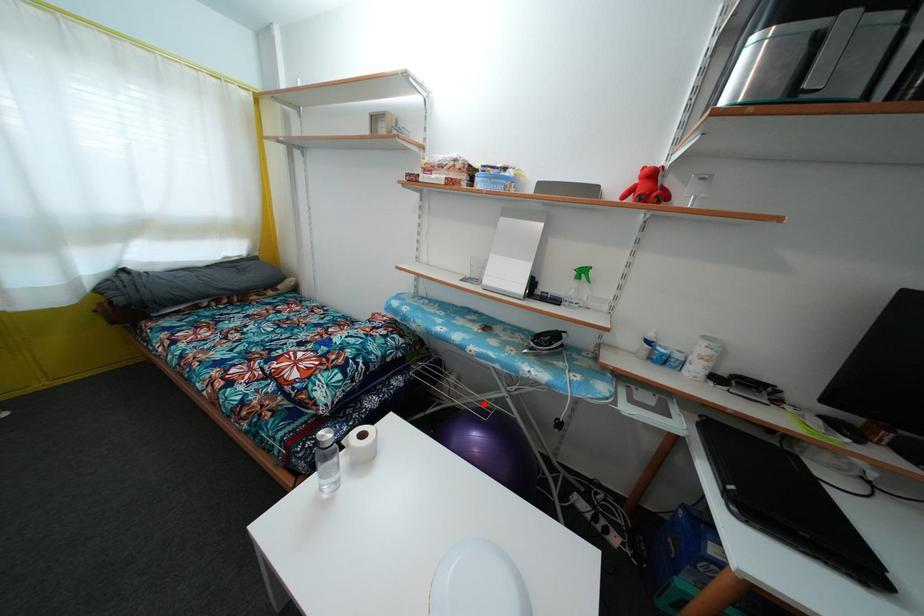
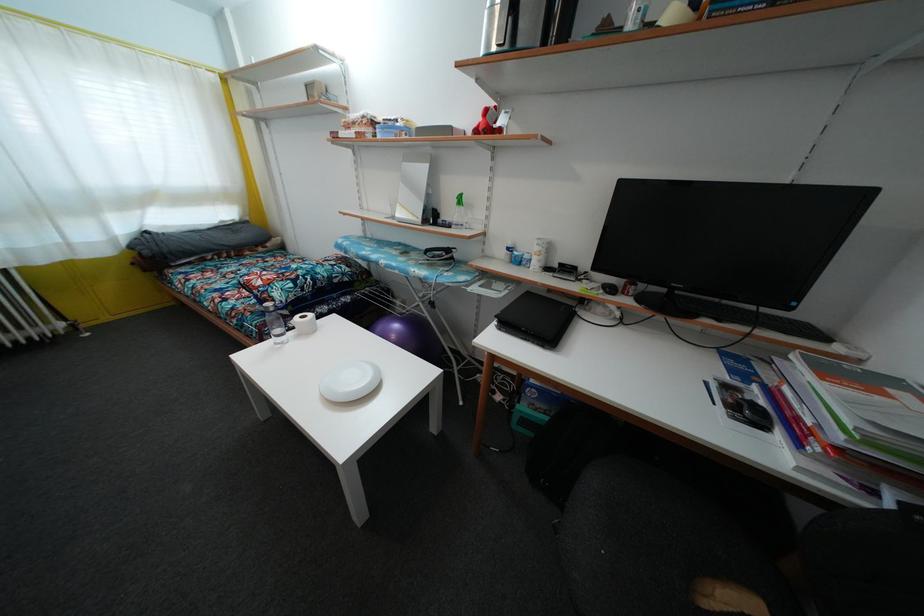
Where in the second image is the point corresponding to the highlighted location from the first image?

(411, 315)